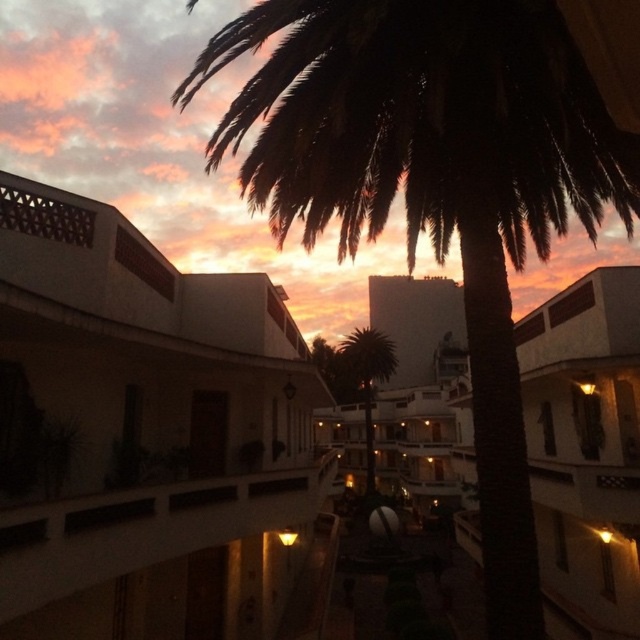
You are standing on a balcony and want to take a photo of the white matte building at upper left. Based on its position in the scene, where should you aim your camera to capture it in the frame?

The white matte building at upper left is located at point (144,433), so you should aim your camera towards the upper left portion of the scene to capture it in the frame.

You are standing on the balcony looking at the scene. There are two points marked in the image. One is at coordinate point [116,285] and the other is at point [433,83]. Which point is closer to you?

Point [116,285] is closer to you because it is further to the viewer than point [433,83].

You are standing on the balcony and want to take a photo that includes both the white matte building at upper left and the dark green leafy palm tree at upper center. Which object should you position closer to the left side of your camera frame?

You should position the white matte building at upper left closer to the left side of your camera frame since it is already located to the left of the dark green leafy palm tree at upper center in the scene.